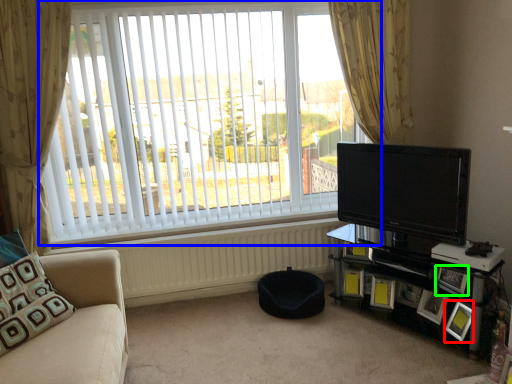
Question: Considering the real-world distances, which object is closest to picture frame (highlighted by a red box)? window (highlighted by a blue box) or picture frame (highlighted by a green box).

Choices:
 (A) window
 (B) picture frame

Answer: (B)